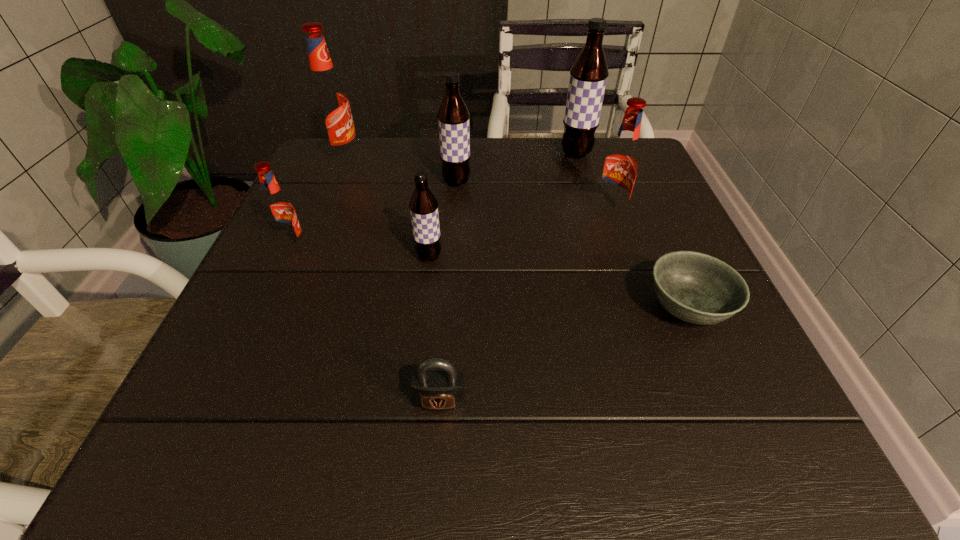
Where is `free space that satisfies the following two spatial constraints: 1. on the back side of the smallest red root beer; 2. on the left side of the biggest brown root beer`? This screenshot has width=960, height=540. free space that satisfies the following two spatial constraints: 1. on the back side of the smallest red root beer; 2. on the left side of the biggest brown root beer is located at coordinates (336, 154).

Locate an element on the screen. This screenshot has width=960, height=540. free space in the image that satisfies the following two spatial constraints: 1. on the front side of the gray bowl; 2. on the right side of the second farthest brown root beer is located at coordinates pyautogui.click(x=448, y=308).